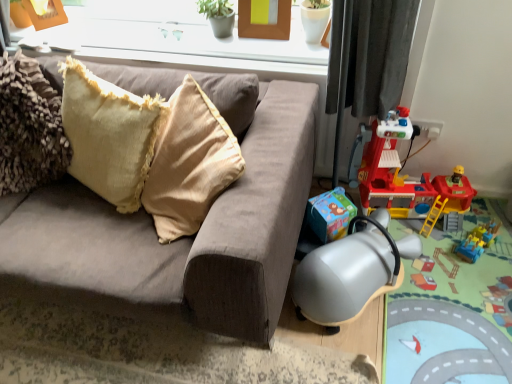
Question: In the image, is white plastic window frame at upper center on the left side or the right side of metallic plastic playset at lower right?

Choices:
 (A) right
 (B) left

Answer: (B)

Question: Considering the positions of white plastic window frame at upper center and metallic plastic playset at lower right in the image, is white plastic window frame at upper center wider or thinner than metallic plastic playset at lower right?

Choices:
 (A) wide
 (B) thin

Answer: (B)

Question: Which object is positioned closest to the velvet gray couch at left?

Choices:
 (A) white plastic window frame at upper center
 (B) blue plastic toy at lower right, the second toy viewed from the top
 (C) plastic red fire station at right, positioned as the second toy in bottom-to-top order
 (D) metallic gray swivel chair at lower right
 (E) brown wooden picture frame at upper center

Answer: (D)

Question: Which of these objects is positioned farthest from the white plastic window frame at upper center?

Choices:
 (A) blue plastic toy at lower right, placed as the 1th toy when sorted from bottom to top
 (B) beige textured pillow at upper left
 (C) metallic plastic playset at lower right
 (D) velvet gray couch at left
 (E) metallic gray swivel chair at lower right

Answer: (A)